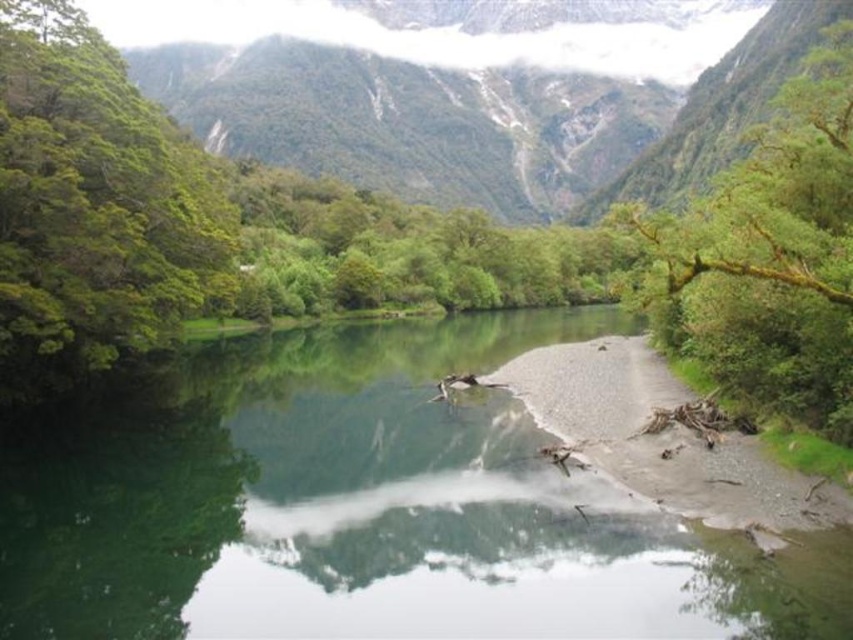
Question: Is green mossy rock at upper center smaller than green leafy tree at left?

Choices:
 (A) no
 (B) yes

Answer: (A)

Question: Which object is positioned farthest from the green mossy rock at upper center?

Choices:
 (A) green mossy branch at upper right
 (B) clear water at center
 (C) green leafy tree at left

Answer: (B)

Question: Which point is farther from the camera taking this photo?

Choices:
 (A) pyautogui.click(x=276, y=424)
 (B) pyautogui.click(x=495, y=124)

Answer: (B)

Question: Does green mossy rock at upper center have a greater width compared to green leafy tree at left?

Choices:
 (A) no
 (B) yes

Answer: (B)

Question: Where is clear water at center located in relation to green mossy branch at upper right in the image?

Choices:
 (A) left
 (B) right

Answer: (A)

Question: Which of these objects is positioned closest to the green mossy rock at upper center?

Choices:
 (A) clear water at center
 (B) green mossy branch at upper right

Answer: (B)